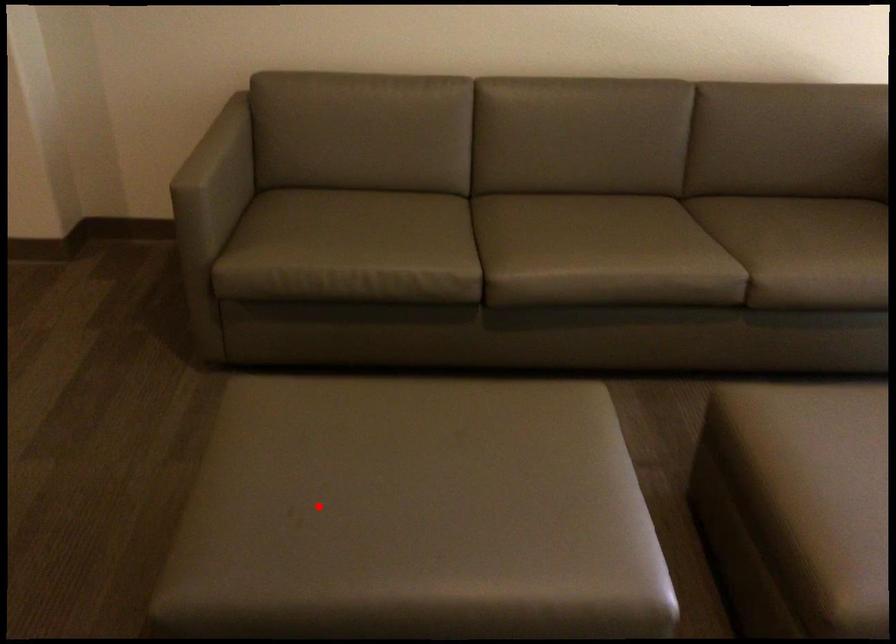
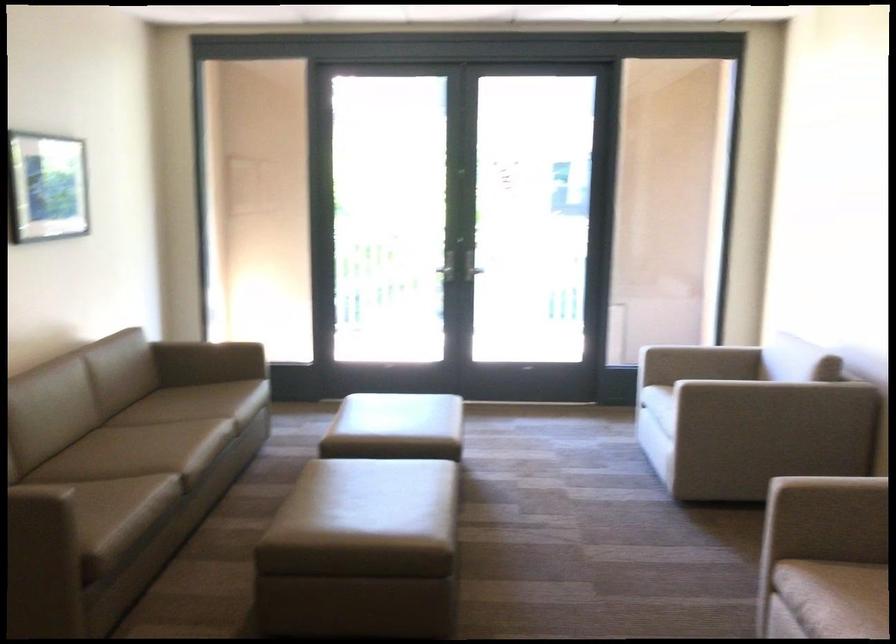
Where in the second image is the point corresponding to the highlighted location from the first image?

(367, 521)